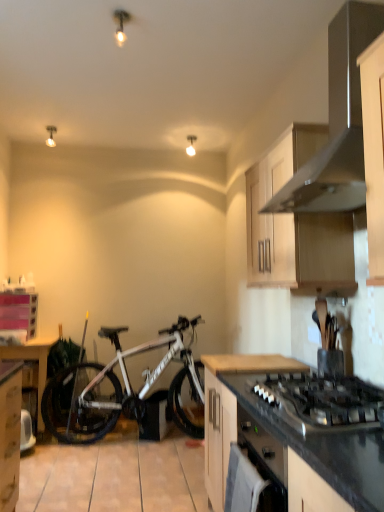
Question: Is wooden table at left with black granite countertop at lower right, positioned as the second countertop in top-to-bottom order?

Choices:
 (A) no
 (B) yes

Answer: (A)

Question: From the image's perspective, is wooden table at left on top of black granite countertop at lower right, positioned as the second countertop in top-to-bottom order?

Choices:
 (A) no
 (B) yes

Answer: (A)

Question: Does wooden table at left have a greater height compared to black granite countertop at lower right, positioned as the second countertop in top-to-bottom order?

Choices:
 (A) yes
 (B) no

Answer: (B)

Question: Is wooden table at left at the left side of black granite countertop at lower right, positioned as the second countertop in top-to-bottom order?

Choices:
 (A) no
 (B) yes

Answer: (B)

Question: Are wooden table at left and black granite countertop at lower right, which ranks as the 1th countertop in bottom-to-top order, located far from each other?

Choices:
 (A) yes
 (B) no

Answer: (A)

Question: Based on their positions, is wooden at center, which appears as the 1th countertop when viewed from the top, located to the left or right of black matte gas stove at lower right?

Choices:
 (A) left
 (B) right

Answer: (A)

Question: Is point (278, 356) closer or farther from the camera than point (329, 392)?

Choices:
 (A) farther
 (B) closer

Answer: (A)

Question: In the image, is wooden at center, which is counted as the second countertop, starting from the bottom, positioned in front of or behind black matte gas stove at lower right?

Choices:
 (A) behind
 (B) front

Answer: (A)

Question: Based on their sizes in the image, would you say wooden at center, which appears as the 1th countertop when viewed from the top, is bigger or smaller than black matte gas stove at lower right?

Choices:
 (A) big
 (B) small

Answer: (B)

Question: Would you say matte white light fixture at upper center, arranged as the first light fixture when viewed from the right, is to the left or to the right of satin silver range hood at upper right in the picture?

Choices:
 (A) left
 (B) right

Answer: (A)

Question: From a real-world perspective, is matte white light fixture at upper center, which ranks as the 1th light fixture in back-to-front order, positioned above or below satin silver range hood at upper right?

Choices:
 (A) above
 (B) below

Answer: (A)

Question: In terms of height, does matte white light fixture at upper center, which ranks as the 1th light fixture in back-to-front order, look taller or shorter compared to satin silver range hood at upper right?

Choices:
 (A) short
 (B) tall

Answer: (A)

Question: In the image, is matte white light fixture at upper center, the 2th light fixture when ordered from front to back, positioned in front of or behind satin silver range hood at upper right?

Choices:
 (A) behind
 (B) front

Answer: (A)

Question: From a real-world perspective, relative to wooden at center, which is counted as the second countertop, starting from the bottom, is matte white light fixture at upper center, which ranks as the 1th light fixture in back-to-front order, vertically above or below?

Choices:
 (A) below
 (B) above

Answer: (B)

Question: Is matte white light fixture at upper center, the 2th light fixture when ordered from front to back, inside the boundaries of wooden at center, which appears as the 1th countertop when viewed from the top, or outside?

Choices:
 (A) inside
 (B) outside

Answer: (B)